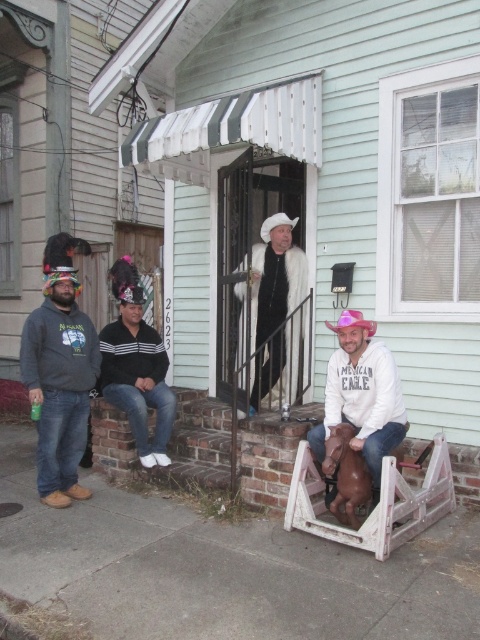
Who is taller, matte gray hoodie at left or white cotton hoodie at lower center?

matte gray hoodie at left is taller.

Does matte gray hoodie at left appear under white cotton hoodie at lower center?

No, matte gray hoodie at left is not below white cotton hoodie at lower center.

Who is more forward, (37, 488) or (395, 364)?

Point (395, 364) is in front.

Find the location of a particular element. Image resolution: width=480 pixels, height=640 pixels. matte gray hoodie at left is located at coordinates (60, 372).

Does white cotton hoodie at lower center have a greater height compared to black striped sweater at center?

No.

Who is positioned more to the right, white cotton hoodie at lower center or black striped sweater at center?

white cotton hoodie at lower center is more to the right.

I want to click on white cotton hoodie at lower center, so click(361, 396).

Who is higher up, matte gray hoodie at left or white fur coat at center?

Answer: Positioned higher is white fur coat at center.

Is matte gray hoodie at left shorter than white fur coat at center?

Incorrect, matte gray hoodie at left's height does not fall short of white fur coat at center's.

Who is more distant from viewer, (x=73, y=364) or (x=294, y=269)?

The point (x=294, y=269) is behind.

What are the coordinates of `matte gray hoodie at left` in the screenshot? It's located at (60, 372).